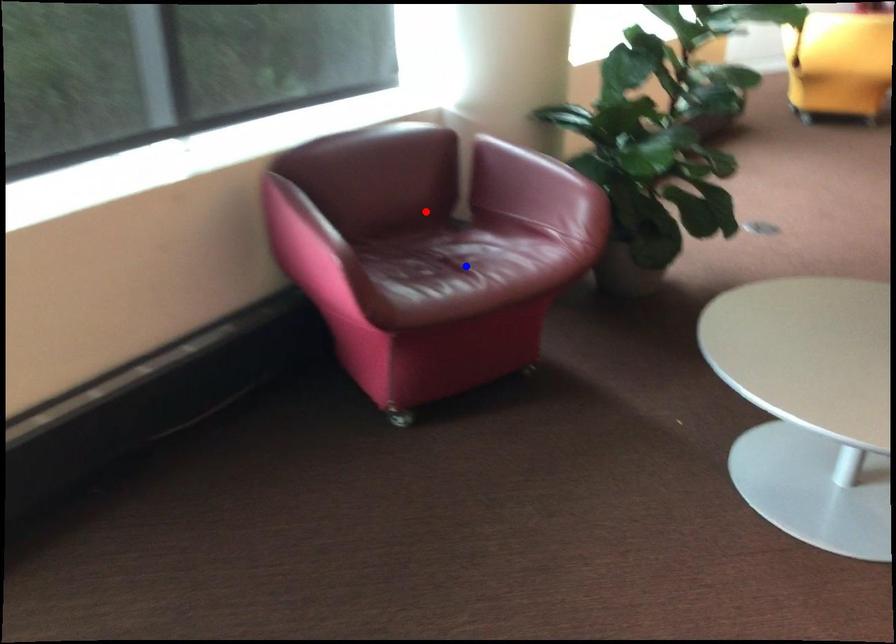
Question: Which of the two points in the image is closer to the camera?

Choices:
 (A) Blue point is closer.
 (B) Red point is closer.

Answer: (A)